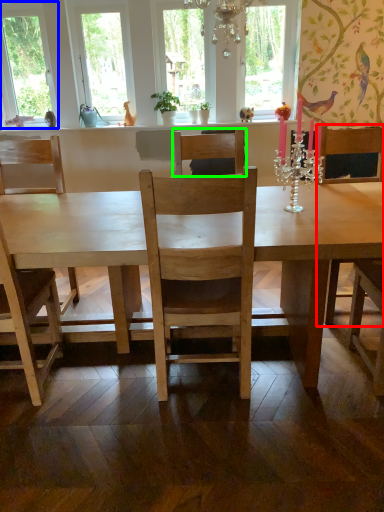
Question: Considering the real-world distances, which object is farthest from armchair (highlighted by a red box)? window (highlighted by a blue box) or chair (highlighted by a green box)?

Choices:
 (A) window
 (B) chair

Answer: (A)